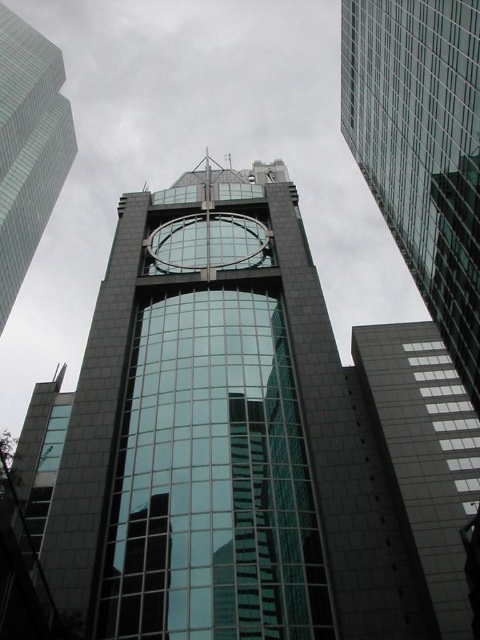
You are standing in front of a modern building with a circular window and rectangular windows. There is a point marked at coordinates (421, 148). What object is located at that point?

The point at coordinates (421, 148) indicates the transparent glass clock tower at center.

You are standing at the entrance of the building and want to locate the transparent glass clock tower at center. According to the coordinates provided, where should you look to find it?

The transparent glass clock tower at center is located at coordinates point 0.233 on the x axis and 0.879 on the y axis.